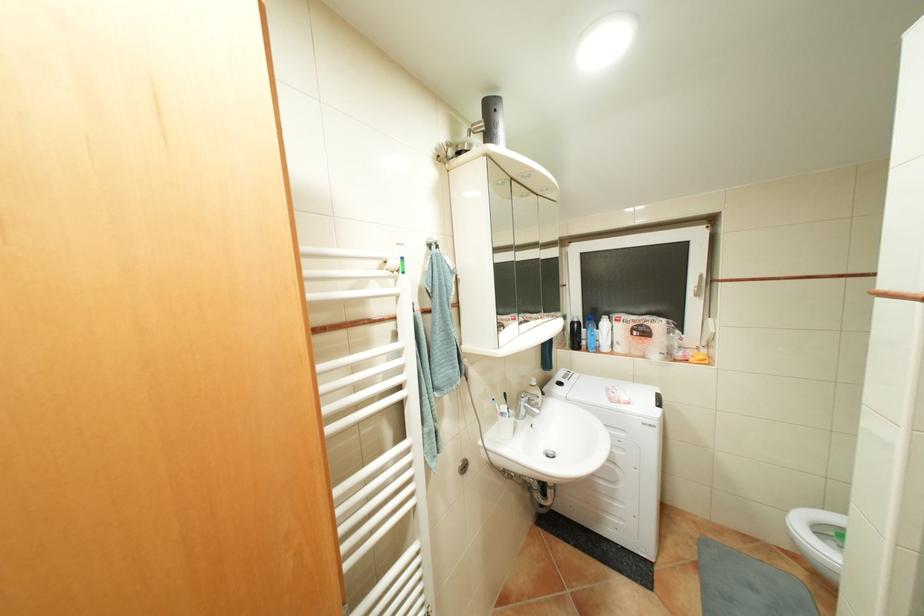
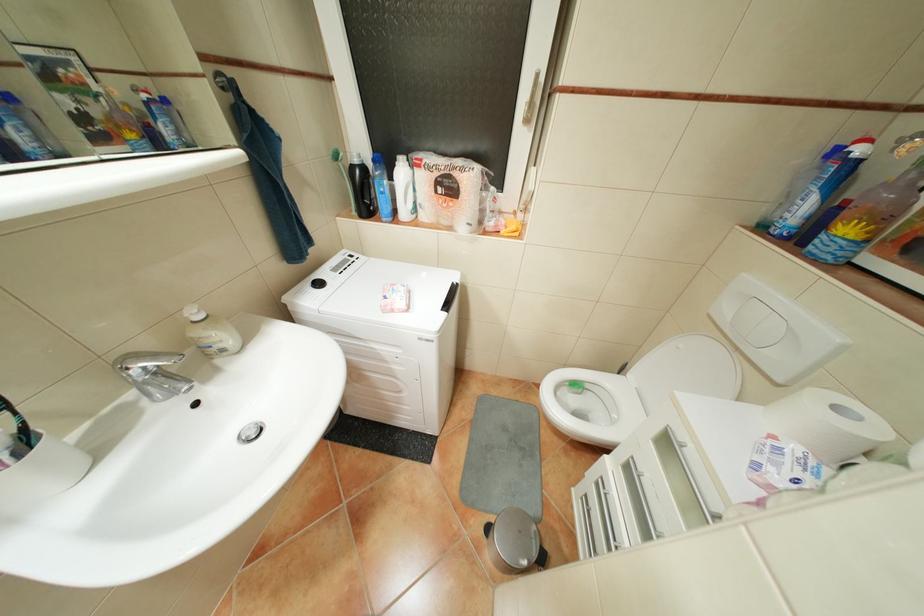
Question: I am providing you with two images of the same scene from different viewpoints. Please identify which objects are invisible in image2.

Choices:
 (A) toilet flush button
 (B) cleaning bottle
 (C) washing machine dial
 (D) none of these

Answer: (D)